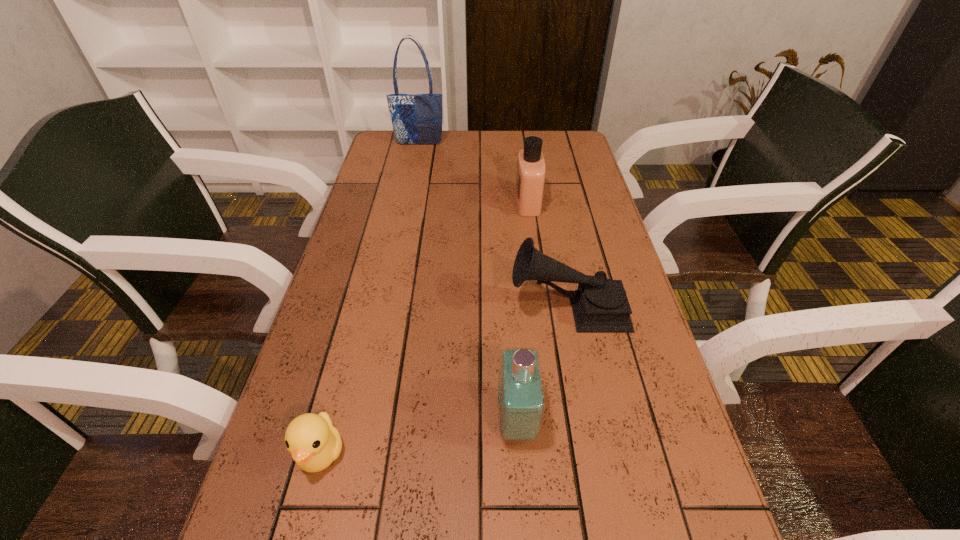
Identify the location of vacant area that satisfies the following two spatial constraints: 1. from the horn of the phonograph_record; 2. on the face of the shortest object. The image size is (960, 540). (596, 453).

Image resolution: width=960 pixels, height=540 pixels. What are the coordinates of `free space that satisfies the following two spatial constraints: 1. on the front label of the nearer perfume; 2. on the face of the shortest object` in the screenshot? It's located at (518, 453).